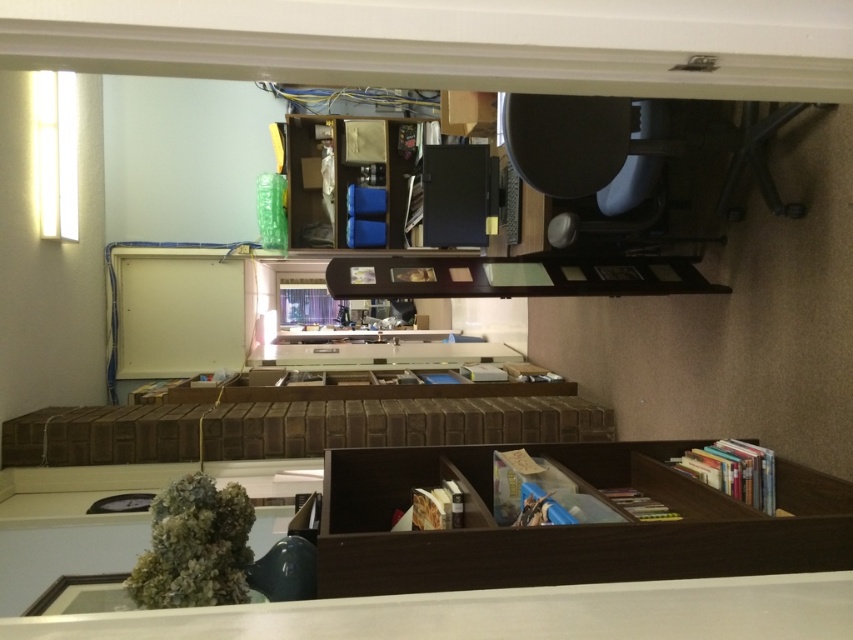
Does brown wooden drawer at center lie behind wooden frame at center?

Yes, it is.

Does brown wooden drawer at center have a lesser height compared to wooden frame at center?

No, brown wooden drawer at center is not shorter than wooden frame at center.

Between point (453, 401) and point (386, 276), which one is positioned in front?

Point (386, 276) is in front.

Identify the location of brown wooden drawer at center. (397, 424).

Who is lower down, brown wood bookshelf at center or wooden bookshelf at upper center?

Positioned lower is brown wood bookshelf at center.

Is point (595, 566) behind point (344, 136)?

That is False.

Locate an element on the screen. This screenshot has width=853, height=640. brown wood bookshelf at center is located at coordinates (566, 525).

You are a GUI agent. You are given a task and a screenshot of the screen. Output one action in this format:
    pyautogui.click(x=<x>, y=<y>)
    Task: Click on the brown wood bookshelf at center
    
    Given the screenshot: What is the action you would take?
    pyautogui.click(x=566, y=525)

Is point (433, 266) farther from camera compared to point (386, 246)?

No.

Does wooden frame at center appear over wooden bookshelf at upper center?

No.

Is point (619, 294) less distant than point (306, 224)?

Yes, it is in front of point (306, 224).

Locate an element on the screen. wooden frame at center is located at coordinates (511, 276).